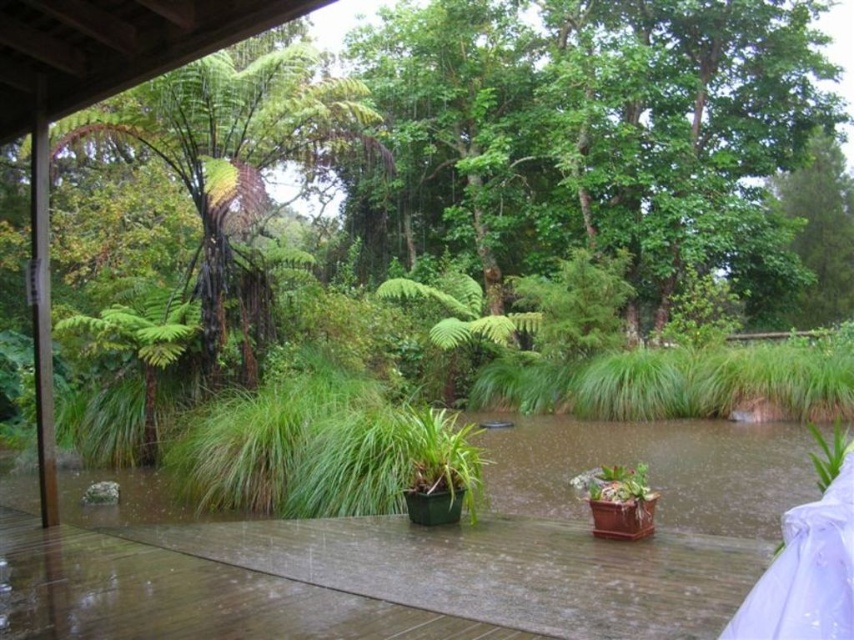
You are standing on the wooden deck and want to place a new potted plant between the two existing points, point (747,284) and point (252,605). Which point should you move towards to ensure the new plant is closer to the camera?

You should move towards point (747,284) because it is further to the camera than point (252,605), so placing the new plant near that point will keep it closer to the camera.

You are standing on the brown wooden deck at center and want to look towards the green leafy tree at upper center. Which direction should you turn your head?

You should turn your head to the right because the green leafy tree at upper center is located to the right of the brown wooden deck at center.

You are standing on the brown wooden deck at center and want to look over the edge to see the green leafy tree at left. Considering their heights, will the deck block your view of the tree?

The green leafy tree at left is taller than the brown wooden deck at center, so the deck will not block your view of the tree.